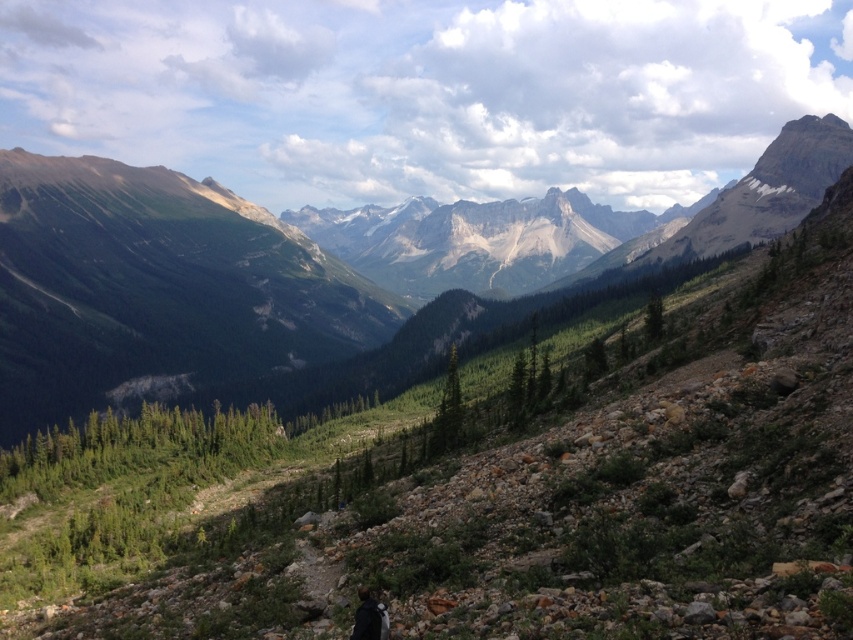
Consider the image. You are a hiker who wants to take a photo of the green rocky mountain at center and the black fabric backpack at lower center. Which object should you focus on first if you want to capture both in the same frame?

The green rocky mountain at center is positioned on the left side of black fabric backpack at lower center, so you should focus on the green rocky mountain at center first to ensure both are in the same frame.